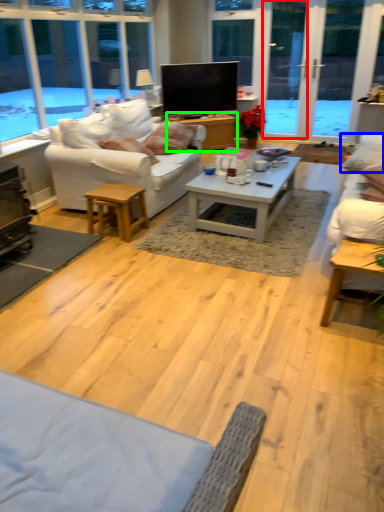
Question: Which is nearer to the screen door (highlighted by a red box)? pillow (highlighted by a blue box) or table (highlighted by a green box).

Choices:
 (A) pillow
 (B) table

Answer: (B)